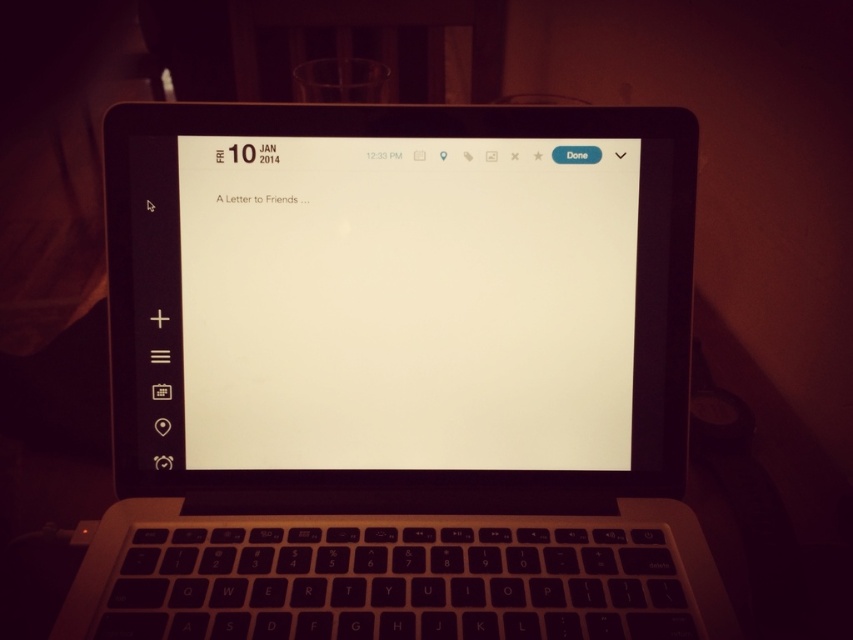
Question: Can you confirm if sleek black laptop at center is positioned to the left of white paper at center?

Choices:
 (A) no
 (B) yes

Answer: (A)

Question: From the image, what is the correct spatial relationship of sleek black laptop at center in relation to white paper at center?

Choices:
 (A) above
 (B) below

Answer: (B)

Question: Can you confirm if sleek black laptop at center is smaller than white paper at center?

Choices:
 (A) no
 (B) yes

Answer: (A)

Question: Which point is closer to the camera?

Choices:
 (A) (515, 336)
 (B) (496, 321)

Answer: (B)